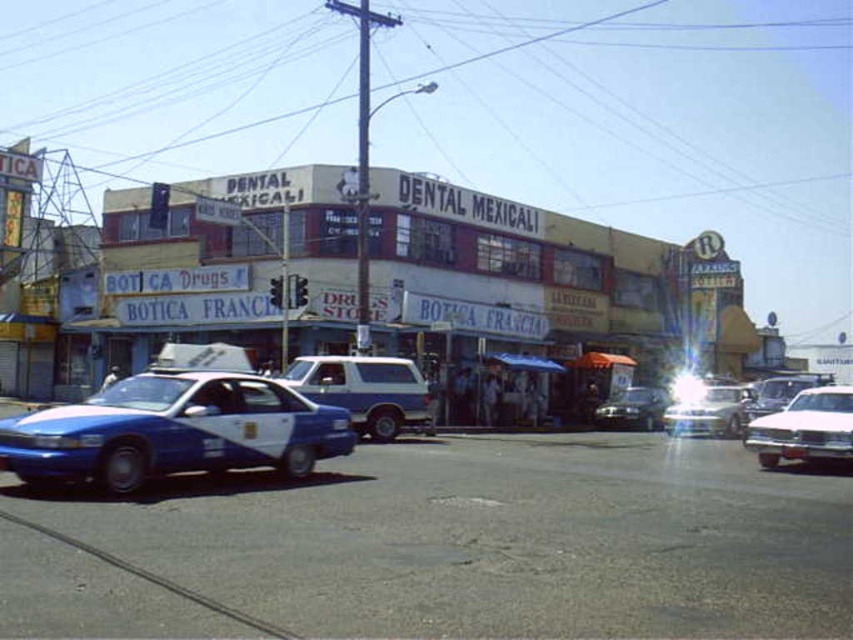
You are a pedestrian standing at the crosswalk and want to cross the street. There is a blue glossy sedan at lower left and a metallic silver car at center. Which car is closer to you?

The blue glossy sedan at lower left is closer to you because it is positioned over the metallic silver car at center, indicating it is in front.

You are a pedestrian standing at the crosswalk in front of the dental clinic building. You need to cross the street to reach the pink glossy sedan at right. Is the blue glossy sedan at lower left blocking your path?

The blue glossy sedan at lower left is closer to the viewer than the pink glossy sedan at right, so it is blocking the path to the pink glossy sedan at right.